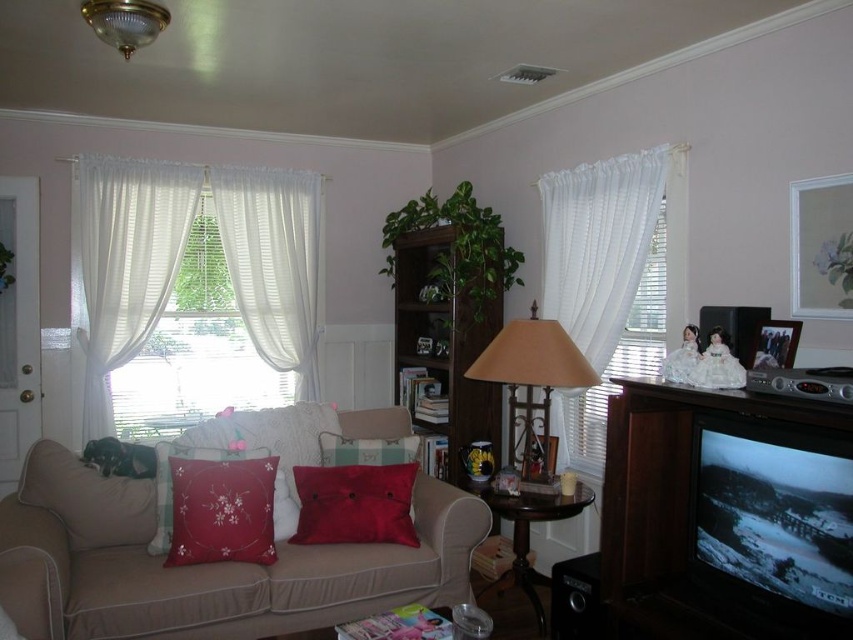
You are arranging flowers in the living room and want to place a vase between the white sheer curtains at right and the matte beige lampshade at center. Based on their positions, where should the vase be placed?

The vase should be placed below the white sheer curtains at right because the white sheer curtains at right is above the matte beige lampshade at center.

You are standing in the living room and want to open the white sheer curtains at right to let more light in. If you are currently 3 feet away from the curtains, how many more feet do you need to move forward to reach them?

The white sheer curtains at right are 9.71 feet away from the viewer. Since you are already 3 feet away, you need to move forward an additional 6.71 feet to reach them.

You are arranging flowers in the living room and have two red pillows. One is a red satin pillow at lower left and the other is a silky red pillow at center. Which pillow has a greater width?

The red satin pillow at lower left has a greater width than the silky red pillow at center.